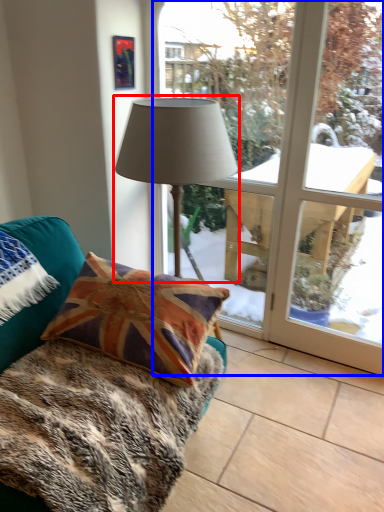
Question: Among these objects, which one is nearest to the camera, lamp (highlighted by a red box) or bay window (highlighted by a blue box)?

Choices:
 (A) lamp
 (B) bay window

Answer: (A)